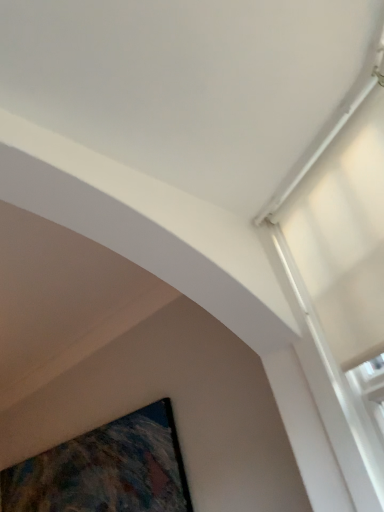
This screenshot has width=384, height=512. In order to click on dark blue textured picture frame at lower left in this screenshot , I will do `click(105, 470)`.

What is the approximate height of dark blue textured picture frame at lower left?

27.46 inches.

The height and width of the screenshot is (512, 384). Describe the element at coordinates (105, 470) in the screenshot. I see `dark blue textured picture frame at lower left` at that location.

At what (x,y) coordinates should I click in order to perform the action: click on dark blue textured picture frame at lower left. Please return your answer as a coordinate pair (x, y). Looking at the image, I should click on (105, 470).